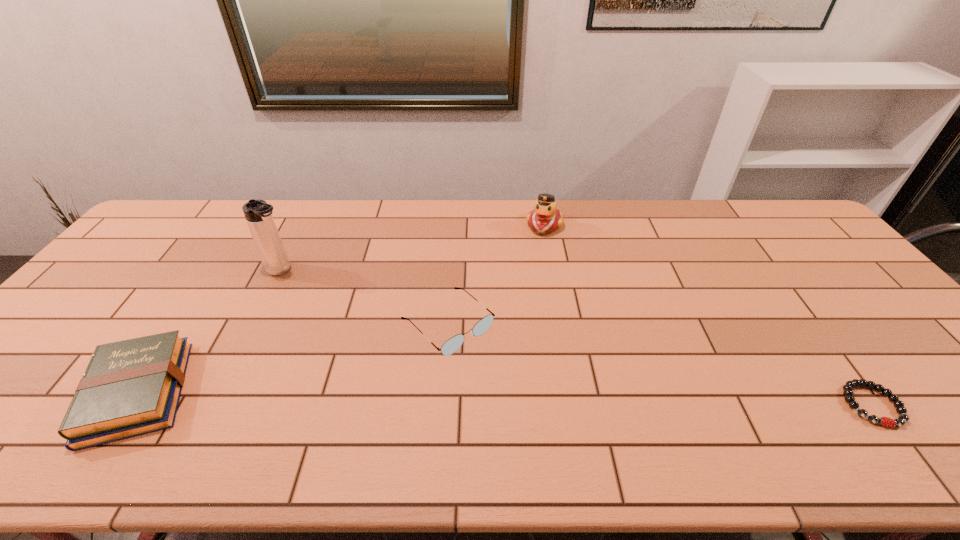
You are a GUI agent. You are given a task and a screenshot of the screen. Output one action in this format:
    pyautogui.click(x=<x>, y=<y>)
    Task: Click on the book that is at the near edge
    This screenshot has height=540, width=960.
    Given the screenshot: What is the action you would take?
    pyautogui.click(x=132, y=387)

You are a GUI agent. You are given a task and a screenshot of the screen. Output one action in this format:
    pyautogui.click(x=<x>, y=<y>)
    Task: Click on the bracelet that is at the near edge
    The image size is (960, 540).
    Given the screenshot: What is the action you would take?
    pyautogui.click(x=848, y=388)

At what (x,y) coordinates should I click in order to perform the action: click on blank space at the far edge of the desktop. Please return your answer as a coordinate pair (x, y). Image resolution: width=960 pixels, height=540 pixels. Looking at the image, I should click on (467, 202).

The width and height of the screenshot is (960, 540). Identify the location of vacant area at the near edge. (709, 403).

In the image, there is a desktop. Where is `free space at the left edge`? The height and width of the screenshot is (540, 960). free space at the left edge is located at coordinates (92, 293).

Identify the location of free space at the right edge of the desktop. The image size is (960, 540). tap(837, 292).

In order to click on free space at the far left corner in this screenshot , I will do `click(165, 237)`.

In the image, there is a desktop. Where is `vacant space at the near right corner`? The height and width of the screenshot is (540, 960). vacant space at the near right corner is located at coordinates (956, 388).

Locate an element on the screen. The height and width of the screenshot is (540, 960). free space between the leftmost object and the farthest object is located at coordinates click(341, 309).

Locate an element on the screen. vacant region between the rightmost object and the tallest object is located at coordinates (577, 338).